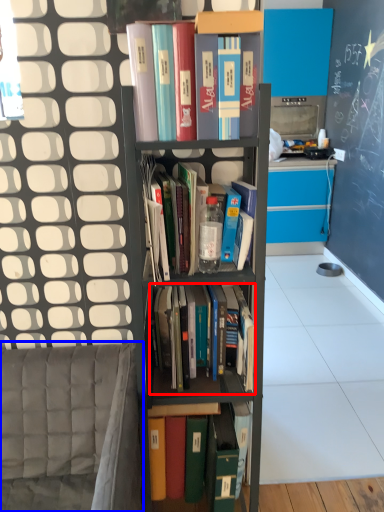
Question: Which object is closer to the camera taking this photo, book (highlighted by a red box) or armchair (highlighted by a blue box)?

Choices:
 (A) book
 (B) armchair

Answer: (B)